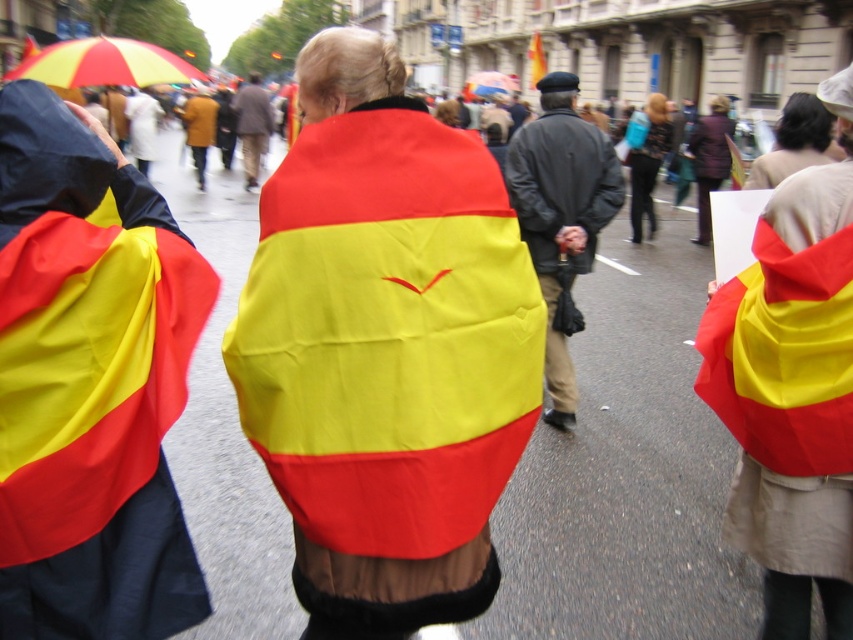
Where is `yellow and red striped umbrella at upper left`? Image resolution: width=853 pixels, height=640 pixels. yellow and red striped umbrella at upper left is located at coordinates (103, 65).

Who is taller, yellow and red striped umbrella at upper left or brown leather jacket at center?

yellow and red striped umbrella at upper left

Does point (47, 64) lie in front of point (251, 83)?

Yes, it is in front of point (251, 83).

Find the location of a particular element. The height and width of the screenshot is (640, 853). yellow and red striped umbrella at upper left is located at coordinates (103, 65).

Which is below, yellow and red striped umbrella at upper left or rainbow fabric umbrella at upper center?

Positioned lower is rainbow fabric umbrella at upper center.

Does yellow and red striped umbrella at upper left have a lesser height compared to rainbow fabric umbrella at upper center?

No, yellow and red striped umbrella at upper left is not shorter than rainbow fabric umbrella at upper center.

Who is more distant from viewer, (103, 74) or (509, 80)?

The point (509, 80) is more distant.

This screenshot has height=640, width=853. I want to click on yellow and red striped umbrella at upper left, so click(x=103, y=65).

Between point (563, 429) and point (578, 172), which one is positioned behind?

Positioned behind is point (563, 429).

Does leather jacket at center have a lesser width compared to dark gray matte jacket at center?

Indeed, leather jacket at center has a lesser width compared to dark gray matte jacket at center.

Is point (560, 221) positioned before point (532, 225)?

That is True.

Locate an element on the screen. leather jacket at center is located at coordinates (561, 212).